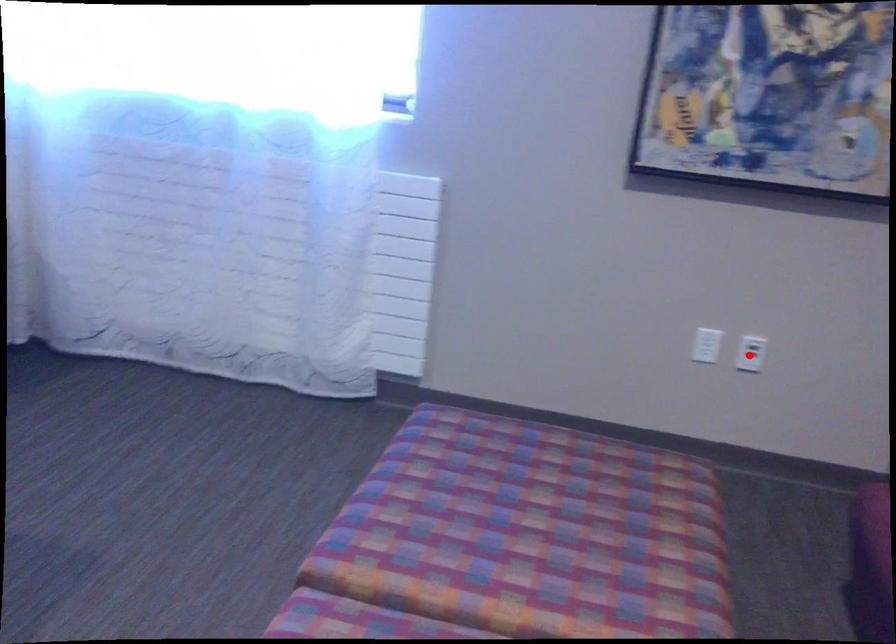
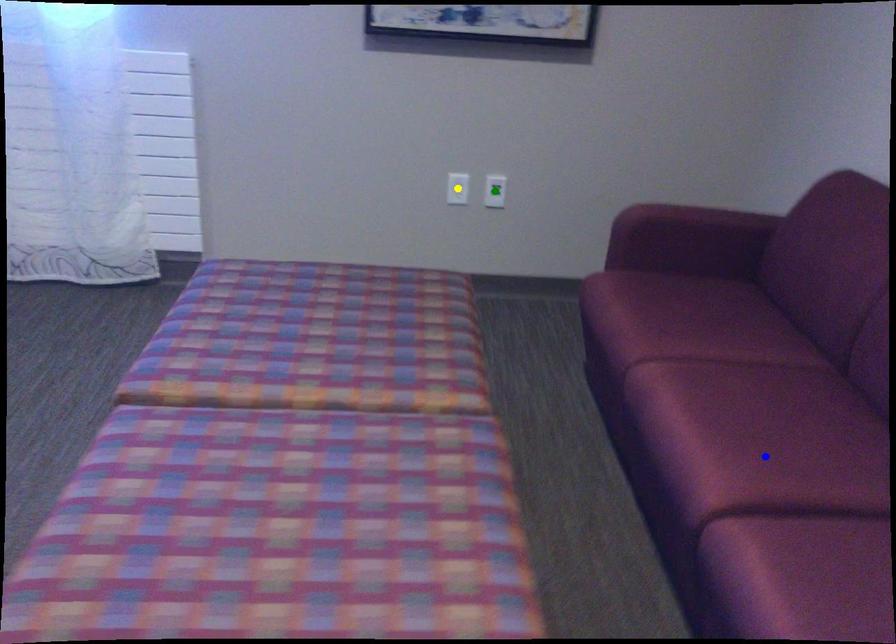
Question: I am providing you with two images of the same scene from different viewpoints. A red point is marked on the first image. You are given multiple points on the second image. Can you choose the point in image 2 that corresponds to the point in image 1?

Choices:
 (A) yellow point
 (B) green point
 (C) blue point

Answer: (B)